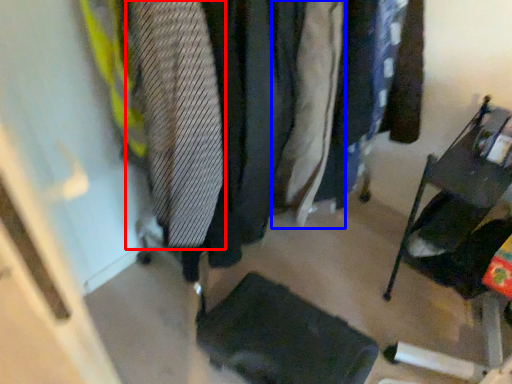
Question: Which object is further to the camera taking this photo, tie (highlighted by a red box) or clothing (highlighted by a blue box)?

Choices:
 (A) tie
 (B) clothing

Answer: (B)